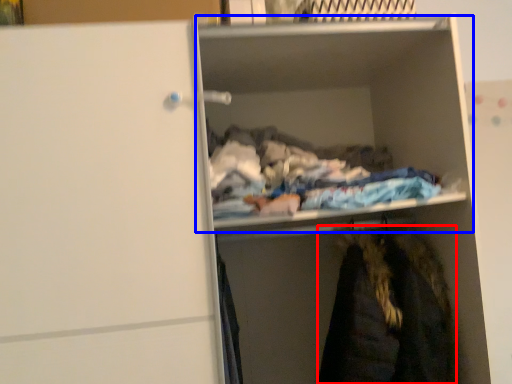
Question: Which object appears farthest to the camera in this image, cloak (highlighted by a red box) or cabinet (highlighted by a blue box)?

Choices:
 (A) cloak
 (B) cabinet

Answer: (A)